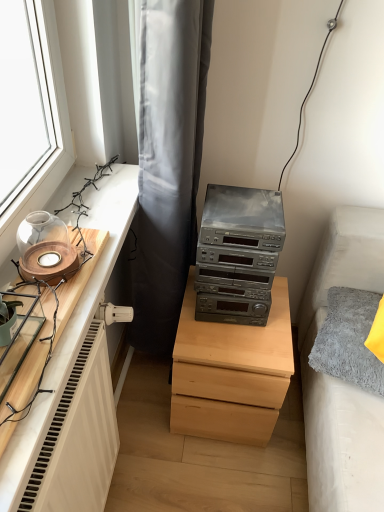
Locate an element on the screen. This screenshot has width=384, height=512. empty space that is ontop of light wood chest of drawers at center (from a real-world perspective) is located at coordinates (242, 327).